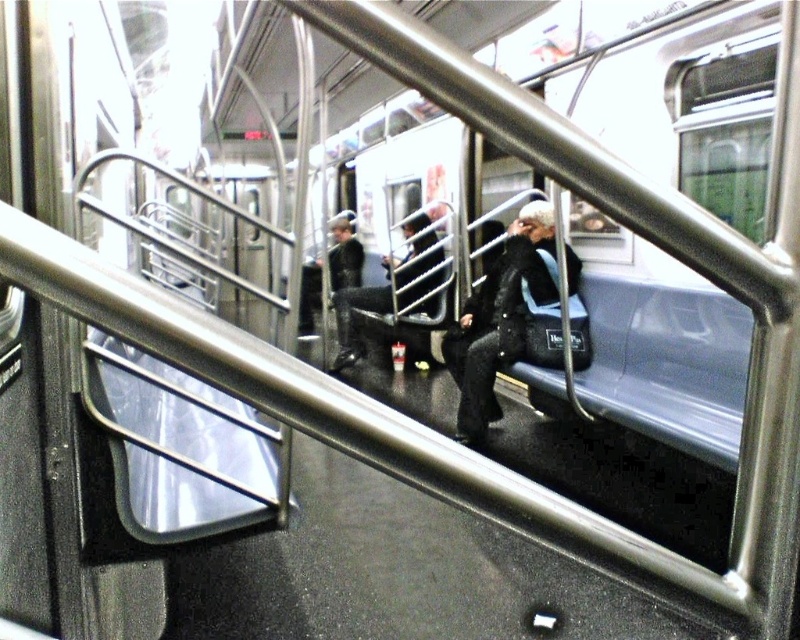
Question: From the image, what is the correct spatial relationship of sparkly black coat at center in relation to black leather jacket at center?

Choices:
 (A) left
 (B) right

Answer: (B)

Question: Does sparkly black coat at center come behind black leather jacket at center?

Choices:
 (A) no
 (B) yes

Answer: (A)

Question: Is sparkly black coat at center to the left of black leather jacket at center from the viewer's perspective?

Choices:
 (A) yes
 (B) no

Answer: (B)